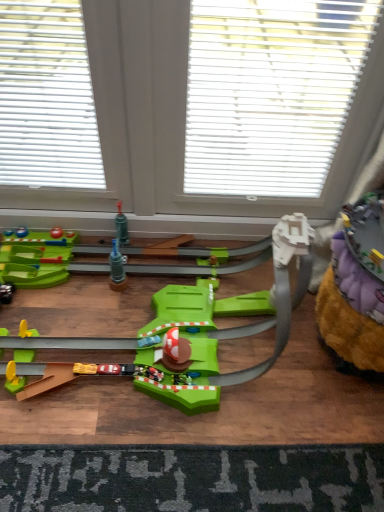
Question: Can you confirm if white plastic blinds at upper center is positioned to the left of white plastic window at center?

Choices:
 (A) yes
 (B) no

Answer: (B)

Question: Is white plastic blinds at upper center positioned behind white plastic window at center?

Choices:
 (A) yes
 (B) no

Answer: (A)

Question: Considering the relative sizes of white plastic blinds at upper center and white plastic window at center in the image provided, is white plastic blinds at upper center thinner than white plastic window at center?

Choices:
 (A) no
 (B) yes

Answer: (B)

Question: From the image's perspective, would you say white plastic blinds at upper center is shown under white plastic window at center?

Choices:
 (A) no
 (B) yes

Answer: (A)

Question: Is white plastic blinds at upper center positioned far away from white plastic window at center?

Choices:
 (A) yes
 (B) no

Answer: (B)

Question: In the image, is dark gray textured mat at lower center positioned in front of or behind fuzzy yellow carpet at lower right, the 2th toy viewed from the left?

Choices:
 (A) front
 (B) behind

Answer: (B)

Question: Is point [x=317, y=505] closer or farther from the camera than point [x=362, y=207]?

Choices:
 (A) closer
 (B) farther

Answer: (A)

Question: Is dark gray textured mat at lower center wider or thinner than fuzzy yellow carpet at lower right, the 2th toy viewed from the left?

Choices:
 (A) thin
 (B) wide

Answer: (B)

Question: In terms of height, does dark gray textured mat at lower center look taller or shorter compared to fuzzy yellow carpet at lower right, the first toy when ordered from right to left?

Choices:
 (A) tall
 (B) short

Answer: (B)

Question: Choose the correct answer: Is green plastic track at center, the 2th toy viewed from the right, inside white plastic window at center or outside it?

Choices:
 (A) outside
 (B) inside

Answer: (A)

Question: From the image's perspective, is green plastic track at center, the 2th toy viewed from the right, above or below white plastic window at center?

Choices:
 (A) above
 (B) below

Answer: (B)

Question: Considering their positions, is green plastic track at center, the 2th toy viewed from the right, located in front of or behind white plastic window at center?

Choices:
 (A) front
 (B) behind

Answer: (A)

Question: From a real-world perspective, is green plastic track at center, the 2th toy viewed from the right, above or below white plastic window at center?

Choices:
 (A) above
 (B) below

Answer: (B)

Question: From the image's perspective, relative to dark gray textured mat at lower center, is white plastic blinds at upper center above or below?

Choices:
 (A) below
 (B) above

Answer: (B)

Question: In terms of width, does white plastic blinds at upper center look wider or thinner when compared to dark gray textured mat at lower center?

Choices:
 (A) wide
 (B) thin

Answer: (B)